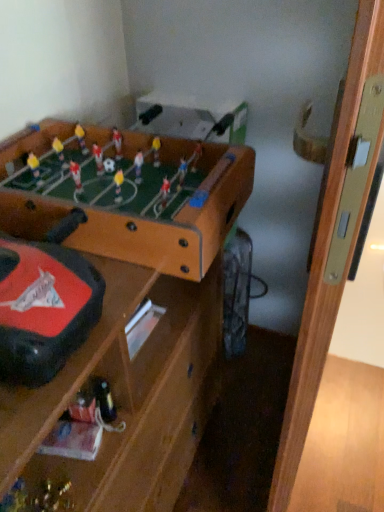
Looking at this image, in order to face brown wooden table at center, the 2th table from the top, should I rotate leftwards or rightwards?

Rotate your view left by about 13.873°.

What do you see at coordinates (110, 309) in the screenshot?
I see `brown wooden table at center, the 2th table from the top` at bounding box center [110, 309].

The height and width of the screenshot is (512, 384). I want to click on brown wooden table at center, which is the 1th table from bottom to top, so click(110, 309).

Which object is closer to the camera, brown wooden table at center, the 2th table from the top, or brown wooden table at upper left, positioned as the second table in bottom-to-top order?

Positioned in front is brown wooden table at center, the 2th table from the top.

Does brown wooden table at center, the 2th table from the top, have a greater width compared to brown wooden table at upper left, which ranks as the first table in top-to-bottom order?

Incorrect, the width of brown wooden table at center, the 2th table from the top, does not surpass that of brown wooden table at upper left, which ranks as the first table in top-to-bottom order.

Considering the positions of points (104, 157) and (177, 161), is point (104, 157) closer to camera compared to point (177, 161)?

No, (104, 157) is further to viewer.

Is brown wooden table at center, the 2th table from the top, not close to brown wooden table at upper left, which ranks as the first table in top-to-bottom order?

No, brown wooden table at center, the 2th table from the top, is not far away from brown wooden table at upper left, which ranks as the first table in top-to-bottom order.

Is metallic gold trophy at lower left positioned before brown wooden table at center, the 2th table from the top?

No, it is behind brown wooden table at center, the 2th table from the top.

Is metallic gold trophy at lower left at the right side of brown wooden table at center, which is the 1th table from bottom to top?

Incorrect, metallic gold trophy at lower left is not on the right side of brown wooden table at center, which is the 1th table from bottom to top.

From the picture: Considering the sizes of objects metallic gold trophy at lower left and brown wooden table at center, which is the 1th table from bottom to top, in the image provided, who is bigger, metallic gold trophy at lower left or brown wooden table at center, which is the 1th table from bottom to top,?

brown wooden table at center, which is the 1th table from bottom to top, is bigger.

Is metallic gold trophy at lower left inside the boundaries of brown wooden table at center, the 2th table from the top, or outside?

The correct answer is: inside.

Based on the photo, which point is more forward, (186, 370) or (7, 497)?

The point (7, 497) is in front.

Which object is positioned more to the left, brown wooden table at center, which is the 1th table from bottom to top, or metallic gold trophy at lower left?

metallic gold trophy at lower left is more to the left.

Is brown wooden table at center, which is the 1th table from bottom to top, positioned in front of metallic gold trophy at lower left?

Yes, brown wooden table at center, which is the 1th table from bottom to top, is closer to the camera.

In terms of width, does brown wooden table at center, which is the 1th table from bottom to top, look wider or thinner when compared to metallic gold trophy at lower left?

In the image, brown wooden table at center, which is the 1th table from bottom to top, appears to be wider than metallic gold trophy at lower left.

From the image's perspective, is metallic gold trophy at lower left below brown wooden table at upper left, positioned as the second table in bottom-to-top order?

Yes, from the image's perspective, metallic gold trophy at lower left is beneath brown wooden table at upper left, positioned as the second table in bottom-to-top order.

From a real-world perspective, is metallic gold trophy at lower left physically above brown wooden table at upper left, which ranks as the first table in top-to-bottom order?

Actually, metallic gold trophy at lower left is physically below brown wooden table at upper left, which ranks as the first table in top-to-bottom order, in the real world.

Considering the relative sizes of metallic gold trophy at lower left and brown wooden table at upper left, which ranks as the first table in top-to-bottom order, in the image provided, is metallic gold trophy at lower left wider than brown wooden table at upper left, which ranks as the first table in top-to-bottom order,?

No.

Is the surface of metallic gold trophy at lower left in direct contact with brown wooden table at upper left, positioned as the second table in bottom-to-top order?

No, metallic gold trophy at lower left is not next to brown wooden table at upper left, positioned as the second table in bottom-to-top order.

From a real-world perspective, does brown wooden table at upper left, positioned as the second table in bottom-to-top order, sit lower than metallic gold trophy at lower left?

No, from a real-world perspective, brown wooden table at upper left, positioned as the second table in bottom-to-top order, is not below metallic gold trophy at lower left.

Can you see brown wooden table at upper left, positioned as the second table in bottom-to-top order, touching metallic gold trophy at lower left?

No, brown wooden table at upper left, positioned as the second table in bottom-to-top order, is not touching metallic gold trophy at lower left.

In the scene shown: How far apart are brown wooden table at upper left, positioned as the second table in bottom-to-top order, and metallic gold trophy at lower left?

brown wooden table at upper left, positioned as the second table in bottom-to-top order, is 53.09 centimeters from metallic gold trophy at lower left.

Is brown wooden table at upper left, which ranks as the first table in top-to-bottom order, not within metallic gold trophy at lower left?

Absolutely, brown wooden table at upper left, which ranks as the first table in top-to-bottom order, is external to metallic gold trophy at lower left.

From a real-world perspective, is brown wooden table at upper left, which ranks as the first table in top-to-bottom order, positioned above or below brown wooden table at center, the 2th table from the top?

Clearly, from a real-world perspective, brown wooden table at upper left, which ranks as the first table in top-to-bottom order, is above brown wooden table at center, the 2th table from the top.

Can you confirm if brown wooden table at upper left, which ranks as the first table in top-to-bottom order, is thinner than brown wooden table at center, the 2th table from the top?

No.

Is the position of brown wooden table at upper left, which ranks as the first table in top-to-bottom order, less distant than that of brown wooden table at center, which is the 1th table from bottom to top?

That is False.

Between brown wooden table at upper left, positioned as the second table in bottom-to-top order, and brown wooden table at center, the 2th table from the top, which one appears on the right side from the viewer's perspective?

Positioned to the right is brown wooden table at upper left, positioned as the second table in bottom-to-top order.

Find the location of `table above the brown wooden table at center, the 2th table from the top (from the image's perspective)`. table above the brown wooden table at center, the 2th table from the top (from the image's perspective) is located at coordinates (125, 194).

This screenshot has width=384, height=512. What are the coordinates of `the 2nd table in front when counting from the metallic gold trophy at lower left` in the screenshot? It's located at (110, 309).

From the image, which object appears to be nearer to brown wooden table at upper left, positioned as the second table in bottom-to-top order, metallic gold trophy at lower left or brown wooden table at center, the 2th table from the top?

Based on the image, brown wooden table at center, the 2th table from the top, appears to be nearer to brown wooden table at upper left, positioned as the second table in bottom-to-top order.

When comparing their distances from metallic gold trophy at lower left, does brown wooden table at upper left, which ranks as the first table in top-to-bottom order, or brown wooden table at center, which is the 1th table from bottom to top, seem further?

Based on the image, brown wooden table at upper left, which ranks as the first table in top-to-bottom order, appears to be further to metallic gold trophy at lower left.

From the image, which object appears to be nearer to metallic gold trophy at lower left, brown wooden table at center, which is the 1th table from bottom to top, or brown wooden table at upper left, positioned as the second table in bottom-to-top order?

brown wooden table at center, which is the 1th table from bottom to top, is closer to metallic gold trophy at lower left.

Estimate the real-world distances between objects in this image. Which object is closer to brown wooden table at center, the 2th table from the top, metallic gold trophy at lower left or brown wooden table at upper left, which ranks as the first table in top-to-bottom order?

brown wooden table at upper left, which ranks as the first table in top-to-bottom order, lies closer to brown wooden table at center, the 2th table from the top, than the other object.

Looking at the image, which one is located further to brown wooden table at center, the 2th table from the top, brown wooden table at upper left, which ranks as the first table in top-to-bottom order, or metallic gold trophy at lower left?

metallic gold trophy at lower left lies further to brown wooden table at center, the 2th table from the top, than the other object.

Looking at the image, which one is located closer to brown wooden table at upper left, which ranks as the first table in top-to-bottom order, brown wooden table at center, which is the 1th table from bottom to top, or metallic gold trophy at lower left?

brown wooden table at center, which is the 1th table from bottom to top, lies closer to brown wooden table at upper left, which ranks as the first table in top-to-bottom order, than the other object.

At what (x,y) coordinates should I click in order to perform the action: click on table between brown wooden table at upper left, which ranks as the first table in top-to-bottom order, and metallic gold trophy at lower left in the up-down direction. Please return your answer as a coordinate pair (x, y). This screenshot has height=512, width=384. Looking at the image, I should click on (110, 309).